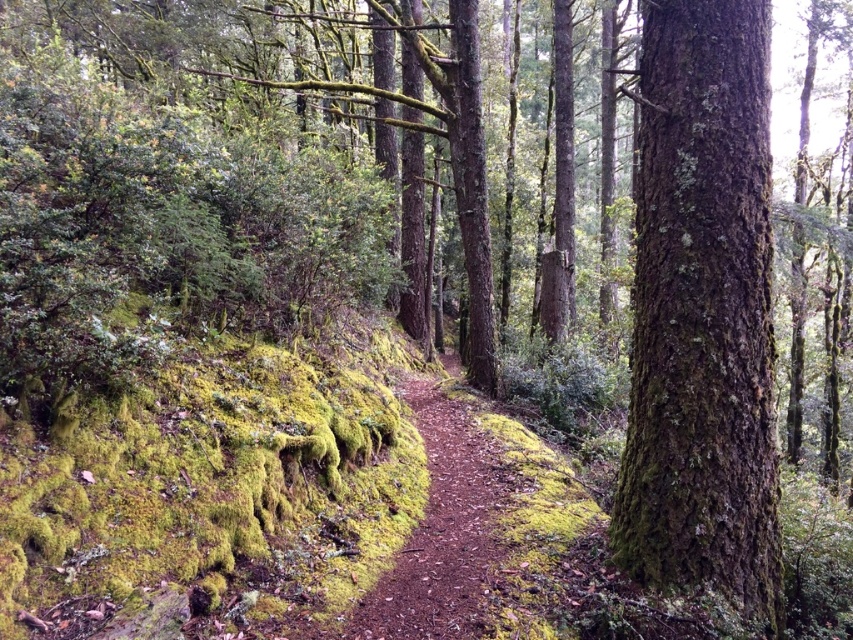
You are a hiker walking along the brown dirt path at center in the forest. You want to take a photo of the green mossy bark tree at center. Which side of the path should you stand on to get the best view of the tree?

The green mossy bark tree at center is positioned on the right side of brown dirt path at center. To get the best view, you should stand on the left side of the brown dirt path at center so that the tree is clearly visible on your right side without obstruction from the path itself.

You are standing on a narrow dirt path in a dense forest. You notice a point marked at coordinates (701, 314). What object is located at this point?

The point at coordinates (701, 314) corresponds to the green mossy bark tree at center.